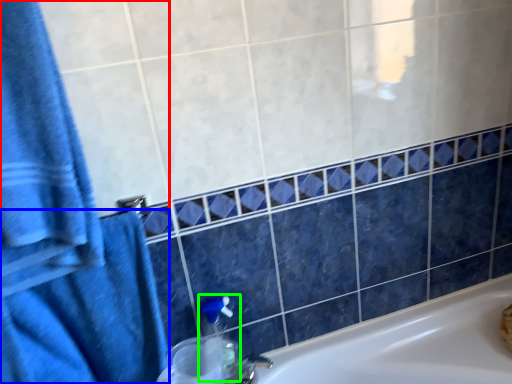
Question: Which object is positioned closest to bath towel (highlighted by a red box)? Select from bath towel (highlighted by a blue box) and soap dispenser (highlighted by a green box).

Choices:
 (A) bath towel
 (B) soap dispenser

Answer: (A)